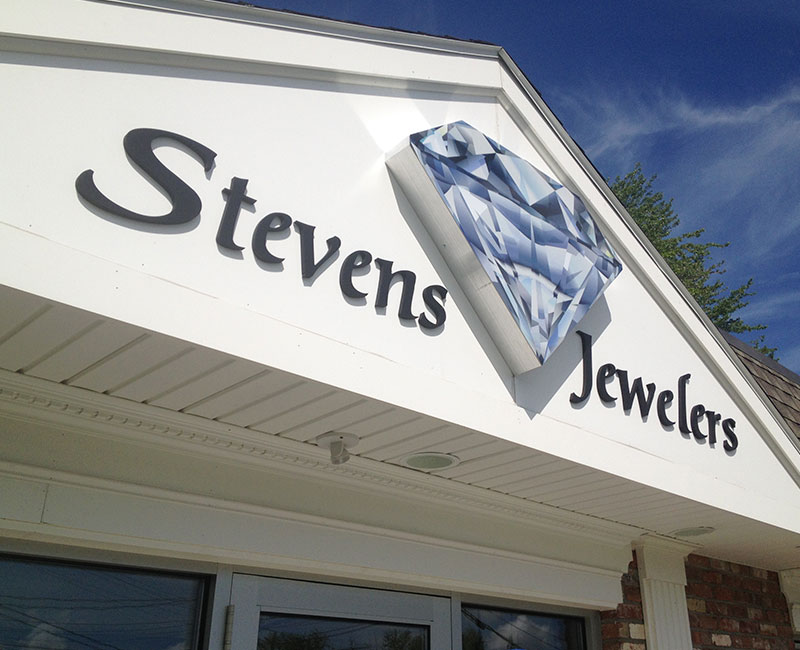
Image resolution: width=800 pixels, height=650 pixels. I want to click on vent, so click(x=434, y=455).